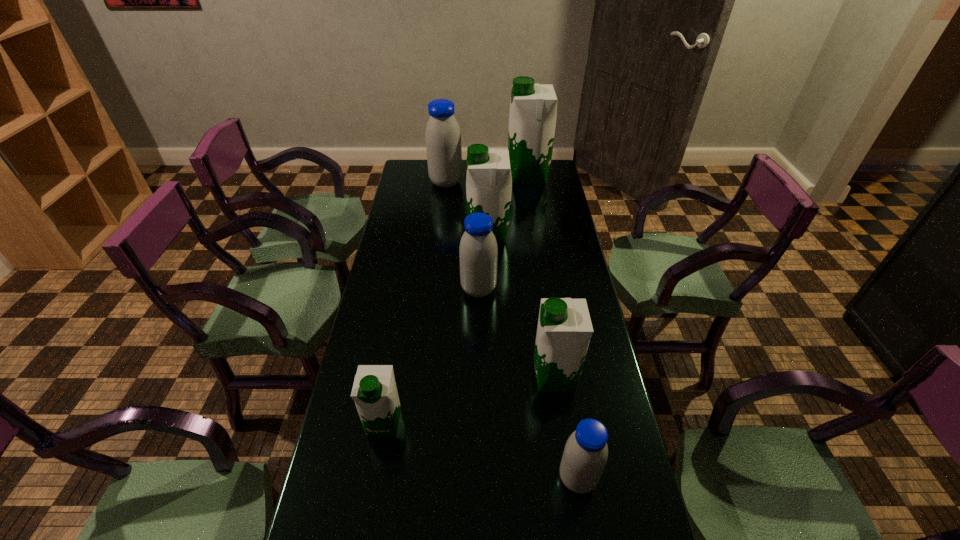
Identify the location of the second nearest soya milk. (374, 391).

The width and height of the screenshot is (960, 540). Identify the location of the leftmost green soya milk. (374, 391).

Image resolution: width=960 pixels, height=540 pixels. What are the coordinates of `the rightmost blue soya milk` in the screenshot? It's located at (585, 455).

At what (x,y) coordinates should I click in order to perform the action: click on the nearest soya milk. Please return your answer as a coordinate pair (x, y). Image resolution: width=960 pixels, height=540 pixels. Looking at the image, I should click on (585, 455).

This screenshot has width=960, height=540. I want to click on free space located on the front-facing side of the tallest object, so pos(454,177).

Find the location of a particular element. This screenshot has height=540, width=960. free spot located 0.110m on the front-facing side of the tallest object is located at coordinates (484, 177).

Where is `free location located 0.120m on the front-facing side of the tallest object`? free location located 0.120m on the front-facing side of the tallest object is located at coordinates (481, 177).

I want to click on vacant region located on the front-facing side of the second farthest green soya milk, so 452,234.

This screenshot has height=540, width=960. I want to click on free region located on the front-facing side of the second farthest green soya milk, so click(x=427, y=234).

You are a GUI agent. You are given a task and a screenshot of the screen. Output one action in this format:
    pyautogui.click(x=<x>, y=<y>)
    Task: Click on the free space located 0.080m on the front-facing side of the second farthest green soya milk
    The width and height of the screenshot is (960, 540).
    Given the screenshot: What is the action you would take?
    pyautogui.click(x=447, y=234)